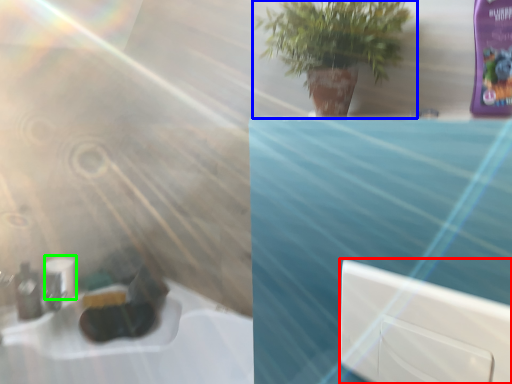
Question: Based on their relative distances, which object is nearer to window (highlighted by a red box)? Choose from houseplant (highlighted by a blue box) and toilet paper (highlighted by a green box).

Choices:
 (A) houseplant
 (B) toilet paper

Answer: (A)